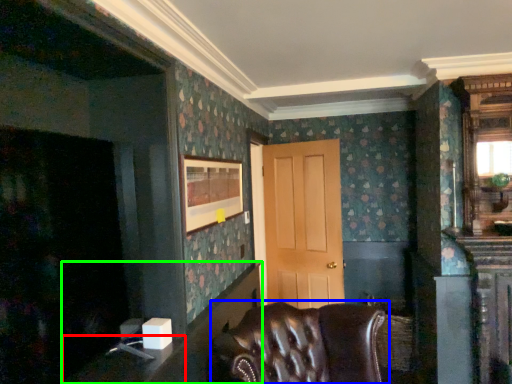
Question: Based on their relative distances, which object is farther from table (highlighted by a red box)? Choose from chair (highlighted by a blue box) and table (highlighted by a green box).

Choices:
 (A) chair
 (B) table

Answer: (A)